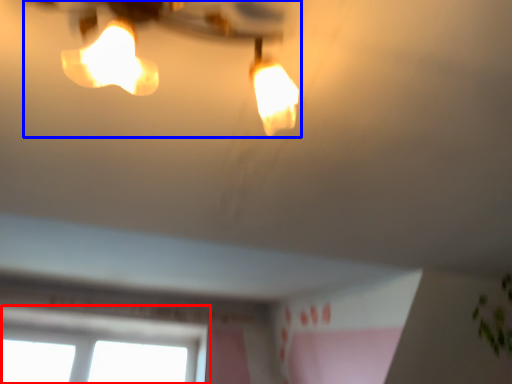
Question: Which object appears farthest to the camera in this image, window (highlighted by a red box) or lamp (highlighted by a blue box)?

Choices:
 (A) window
 (B) lamp

Answer: (A)